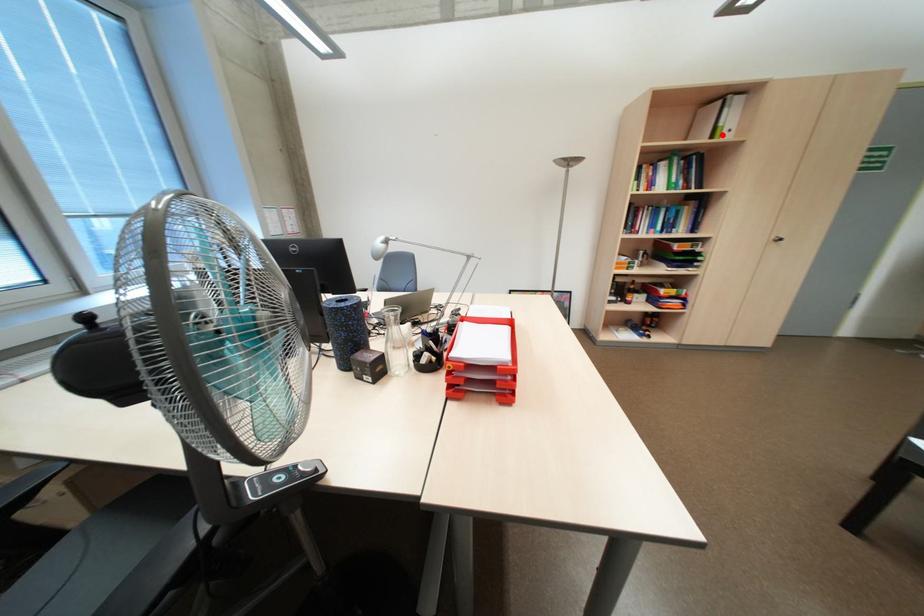
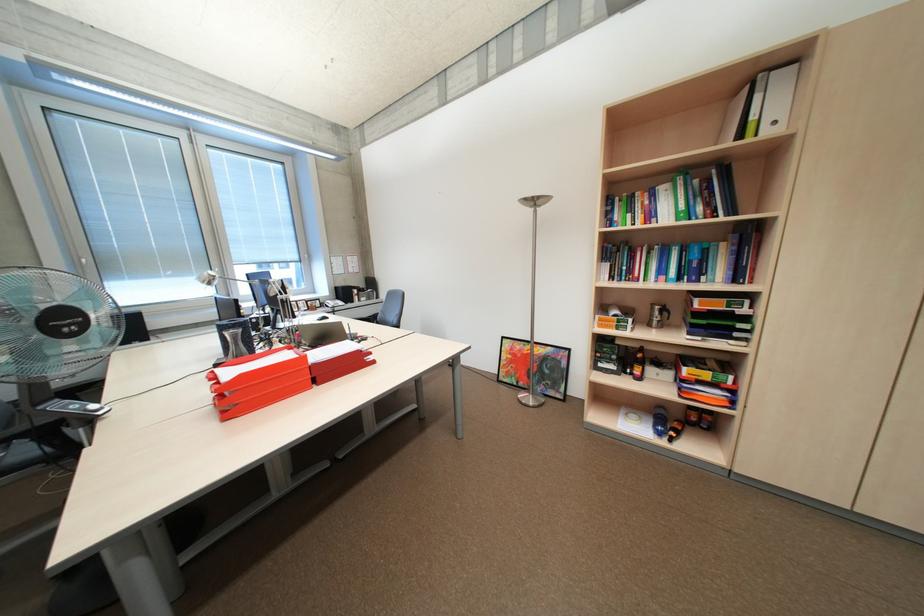
Where in the second image is the point corresponding to the highlighted location from the first image?

(749, 136)